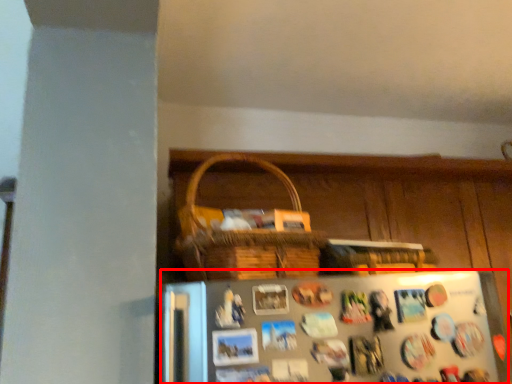
Question: From the image's perspective, what is the correct spatial relationship of refrigerator (annotated by the red box) in relation to dresser?

Choices:
 (A) above
 (B) below

Answer: (A)